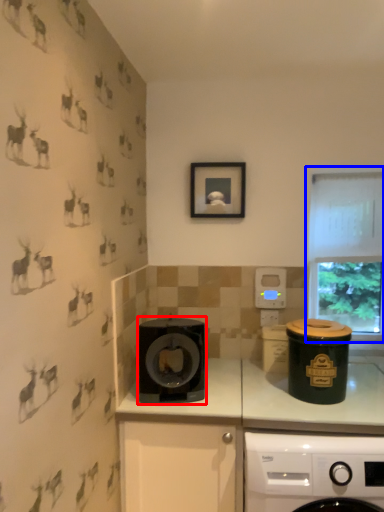
Question: Which point is closer to the camera, kitchen appliance (highlighted by a red box) or window (highlighted by a blue box)?

Choices:
 (A) kitchen appliance
 (B) window

Answer: (A)